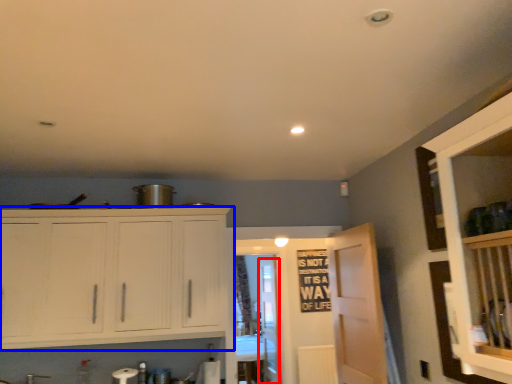
Question: Which object appears farthest to the camera in this image, glass door (highlighted by a red box) or cabinetry (highlighted by a blue box)?

Choices:
 (A) glass door
 (B) cabinetry

Answer: (A)